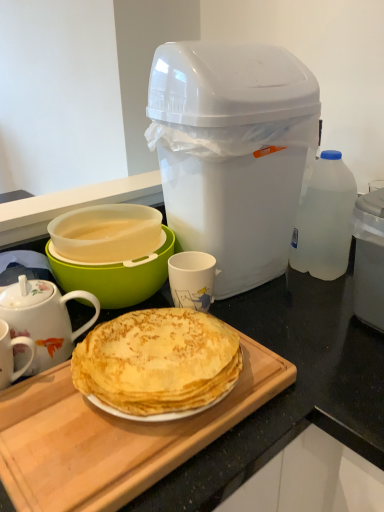
This screenshot has height=512, width=384. I want to click on free point above wooden cutting board at center (from a real-world perspective), so click(x=88, y=421).